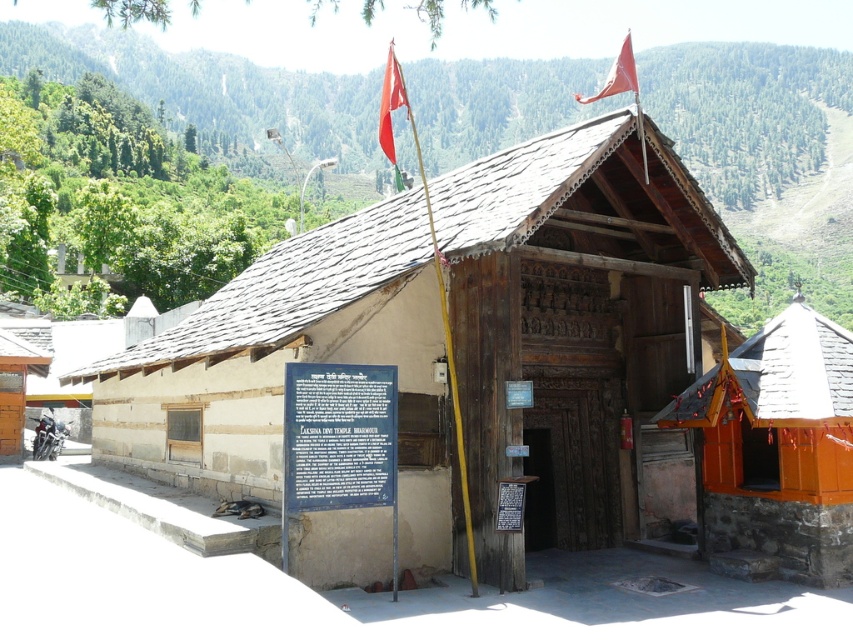
Is point (550, 518) positioned before point (614, 74)?

No.

Is wooden door at center taller than matte red flag at upper right?

No, wooden door at center is not taller than matte red flag at upper right.

Locate an element on the screen. Image resolution: width=853 pixels, height=640 pixels. wooden door at center is located at coordinates (538, 490).

At what (x,y) coordinates should I click in order to perform the action: click on wooden door at center. Please return your answer as a coordinate pair (x, y). The width and height of the screenshot is (853, 640). Looking at the image, I should click on (538, 490).

Who is more distant from viewer, (16, 396) or (396, 99)?

The point (16, 396) is more distant.

Who is taller, wooden hut at center or red fabric flag at upper center?

red fabric flag at upper center is taller.

Is point (10, 340) less distant than point (393, 147)?

No, (10, 340) is further to viewer.

Where is `wooden hut at center`? The image size is (853, 640). wooden hut at center is located at coordinates (19, 378).

Is blue metal sign at center closer to the viewer compared to wooden hut at center?

Yes, blue metal sign at center is in front of wooden hut at center.

Between blue metal sign at center and wooden hut at center, which one is positioned lower?

wooden hut at center

This screenshot has height=640, width=853. Describe the element at coordinates (339, 436) in the screenshot. I see `blue metal sign at center` at that location.

This screenshot has height=640, width=853. What are the coordinates of `blue metal sign at center` in the screenshot? It's located at (339, 436).